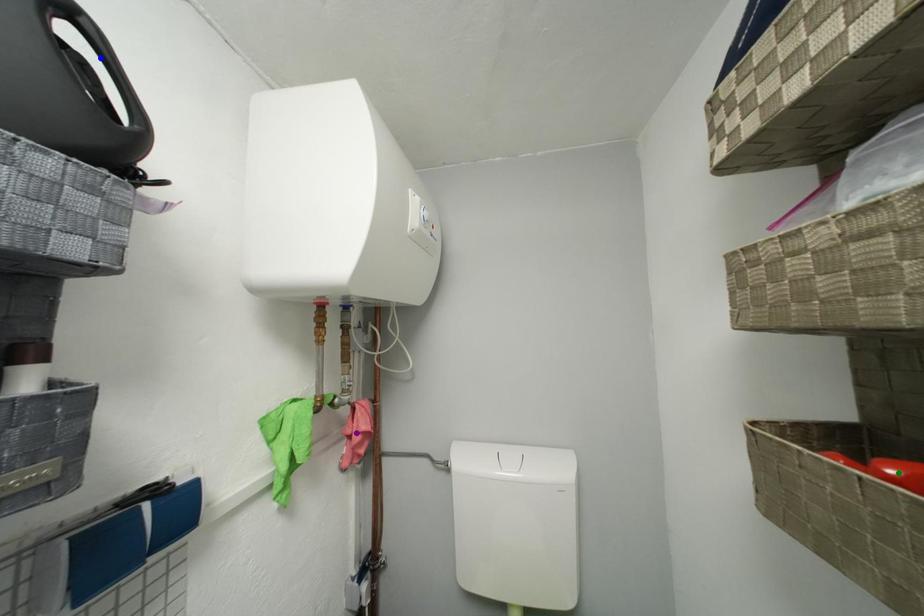
Order these from nearest to farthest:
purple point, green point, blue point

1. purple point
2. blue point
3. green point